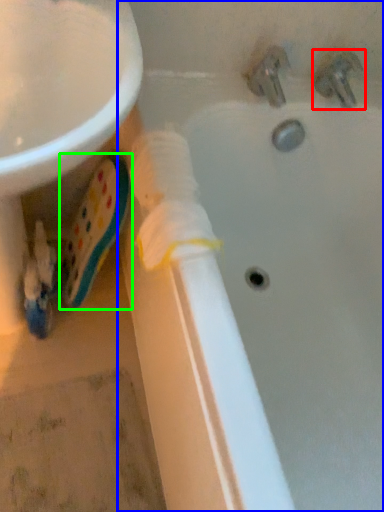
Question: Which is nearer to the tap (highlighted by a red box)? bathtub (highlighted by a blue box) or toothpaste (highlighted by a green box).

Choices:
 (A) bathtub
 (B) toothpaste

Answer: (A)